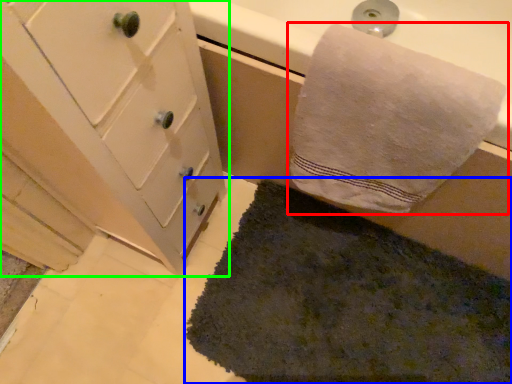
Question: Considering the real-world distances, which object is farthest from towel (highlighted by a red box)? bath mat (highlighted by a blue box) or bathroom cabinet (highlighted by a green box)?

Choices:
 (A) bath mat
 (B) bathroom cabinet

Answer: (A)